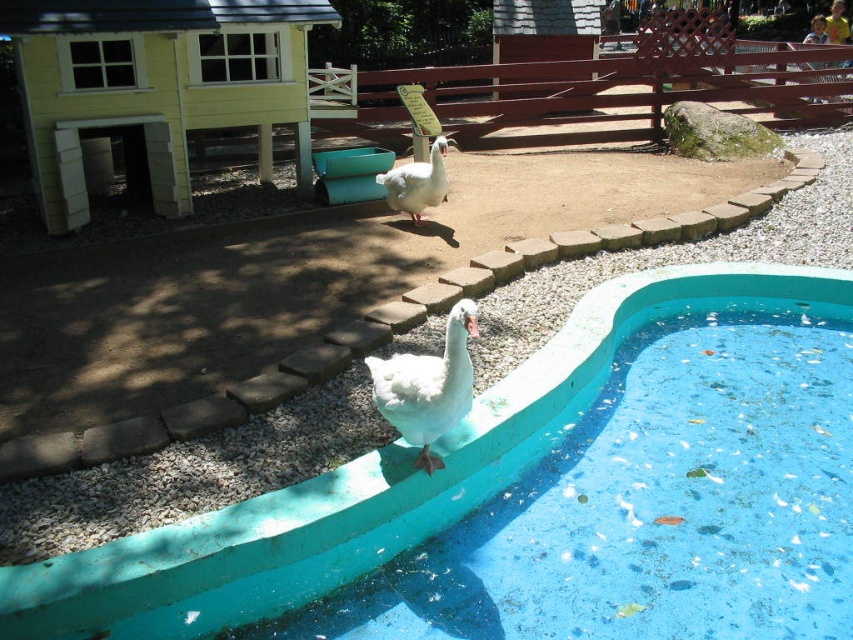
Which is behind, point (444, 332) or point (422, 198)?

Positioned behind is point (422, 198).

Does point (440, 406) come behind point (407, 163)?

No, it is not.

The width and height of the screenshot is (853, 640). What do you see at coordinates (427, 387) in the screenshot?
I see `white fluffy duck at lower center` at bounding box center [427, 387].

Where is `white fluffy duck at lower center`? This screenshot has height=640, width=853. white fluffy duck at lower center is located at coordinates (427, 387).

Does blue rubber swimming pool at center come behind white matte duck at upper center?

No, blue rubber swimming pool at center is in front of white matte duck at upper center.

Who is positioned more to the left, blue rubber swimming pool at center or white matte duck at upper center?

From the viewer's perspective, white matte duck at upper center appears more on the left side.

The height and width of the screenshot is (640, 853). What do you see at coordinates (543, 497) in the screenshot?
I see `blue rubber swimming pool at center` at bounding box center [543, 497].

Where is `blue rubber swimming pool at center`? The width and height of the screenshot is (853, 640). blue rubber swimming pool at center is located at coordinates (543, 497).

Is blue rubber swimming pool at center positioned in front of white fluffy duck at lower center?

Yes, it is.

Does blue rubber swimming pool at center lie behind white fluffy duck at lower center?

No, blue rubber swimming pool at center is in front of white fluffy duck at lower center.

Is point (38, 564) in front of point (439, 426)?

Yes, point (38, 564) is closer to viewer.

At what (x,y) coordinates should I click in order to perform the action: click on blue rubber swimming pool at center. Please return your answer as a coordinate pair (x, y). Looking at the image, I should click on (543, 497).